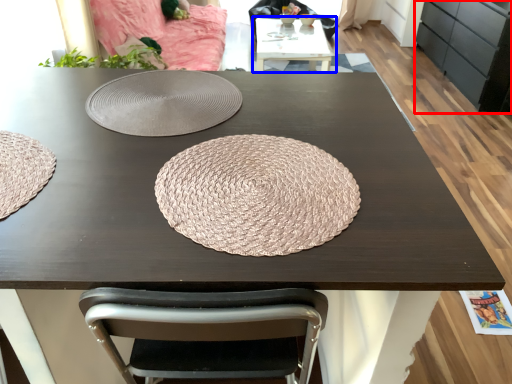
Question: Which of the following is the closest to the observer, cabinetry (highlighted by a red box) or table (highlighted by a blue box)?

Choices:
 (A) cabinetry
 (B) table

Answer: (A)